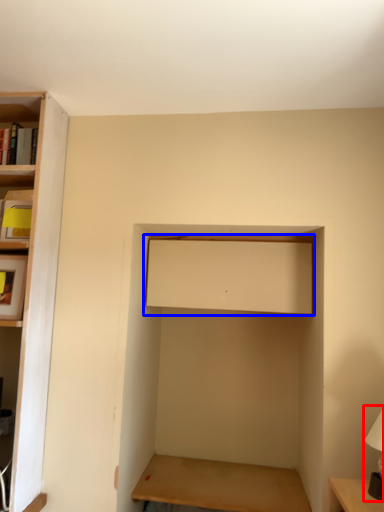
Question: Among these objects, which one is nearest to the camera, table lamp (highlighted by a red box) or cabinet (highlighted by a blue box)?

Choices:
 (A) table lamp
 (B) cabinet

Answer: (A)